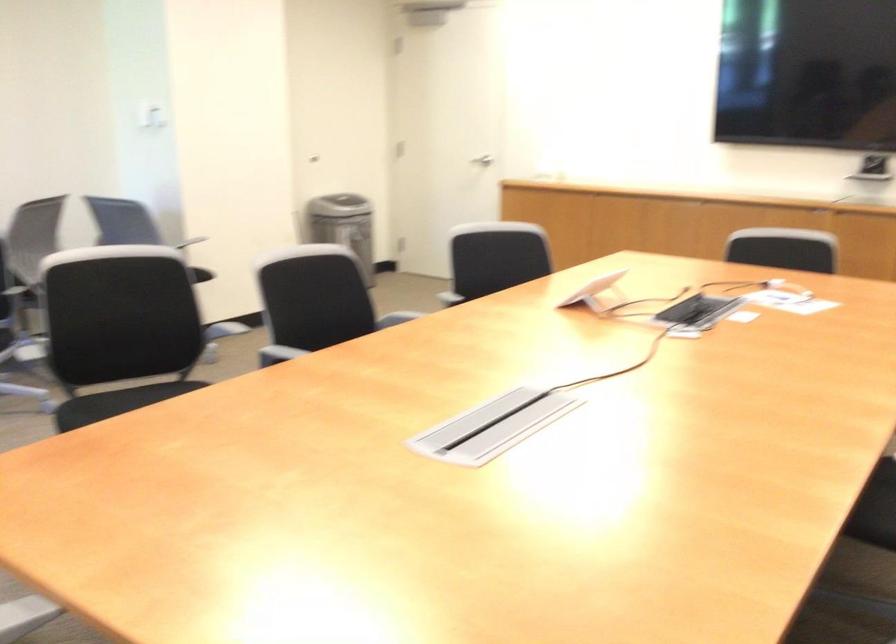
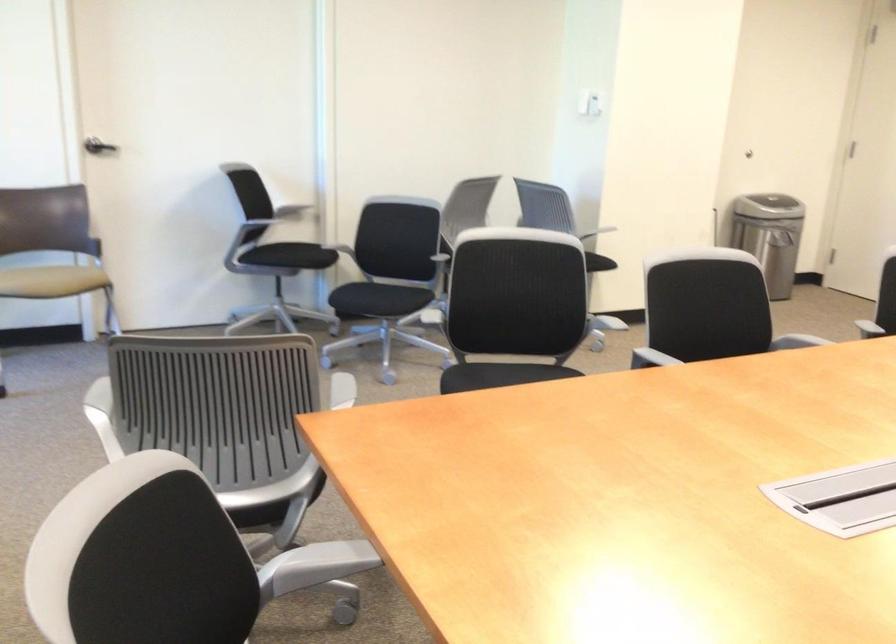
Where in the second image is the point corresponding to the point at 156,120 from the first image?

(590, 102)